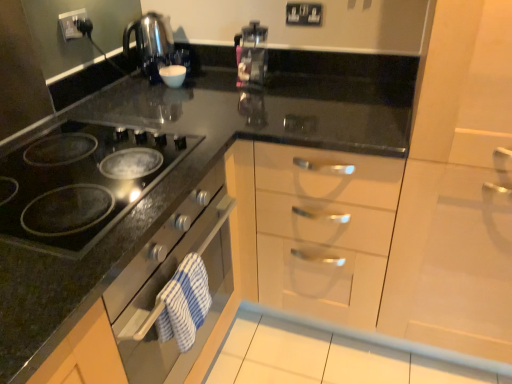
Question: Considering the relative positions of black plastic electric outlet at upper left, acting as the 2th electric outlet starting from the right, and black glass cooktop at left in the image provided, is black plastic electric outlet at upper left, acting as the 2th electric outlet starting from the right, to the right of black glass cooktop at left from the viewer's perspective?

Choices:
 (A) no
 (B) yes

Answer: (A)

Question: Is black plastic electric outlet at upper left, acting as the 2th electric outlet starting from the right, at the left side of black glass cooktop at left?

Choices:
 (A) yes
 (B) no

Answer: (A)

Question: Considering the relative positions of black plastic electric outlet at upper left, the first electric outlet positioned from the front, and black glass cooktop at left in the image provided, is black plastic electric outlet at upper left, the first electric outlet positioned from the front, behind black glass cooktop at left?

Choices:
 (A) no
 (B) yes

Answer: (B)

Question: Is black plastic electric outlet at upper left, the first electric outlet positioned from the front, taller than black glass cooktop at left?

Choices:
 (A) no
 (B) yes

Answer: (B)

Question: From the image's perspective, does black plastic electric outlet at upper left, acting as the 2th electric outlet starting from the right, appear higher than black glass cooktop at left?

Choices:
 (A) yes
 (B) no

Answer: (A)

Question: From a real-world perspective, relative to transparent plastic coffee machine at center, is black glass cooktop at left vertically above or below?

Choices:
 (A) above
 (B) below

Answer: (B)

Question: Visually, is black glass cooktop at left positioned to the left or to the right of transparent plastic coffee machine at center?

Choices:
 (A) right
 (B) left

Answer: (B)

Question: Considering the positions of point (76, 213) and point (266, 29), is point (76, 213) closer or farther from the camera than point (266, 29)?

Choices:
 (A) farther
 (B) closer

Answer: (B)

Question: Is black glass cooktop at left inside the boundaries of transparent plastic coffee machine at center, or outside?

Choices:
 (A) outside
 (B) inside

Answer: (A)

Question: From the image's perspective, relative to black plastic electric outlet at upper left, which is counted as the first electric outlet, starting from the left, is black glass cooktop at left above or below?

Choices:
 (A) above
 (B) below

Answer: (B)

Question: Based on their sizes in the image, would you say black glass cooktop at left is bigger or smaller than black plastic electric outlet at upper left, the first electric outlet positioned from the front?

Choices:
 (A) big
 (B) small

Answer: (A)

Question: Relative to black plastic electric outlet at upper left, placed as the second electric outlet when sorted from back to front, is black glass cooktop at left in front or behind?

Choices:
 (A) front
 (B) behind

Answer: (A)

Question: In terms of width, does black glass cooktop at left look wider or thinner when compared to black plastic electric outlet at upper left, the first electric outlet positioned from the front?

Choices:
 (A) thin
 (B) wide

Answer: (B)

Question: From a real-world perspective, is black glass cooktop at left above or below white glossy cabinet at right?

Choices:
 (A) above
 (B) below

Answer: (A)

Question: Considering the positions of black glass cooktop at left and white glossy cabinet at right in the image, is black glass cooktop at left bigger or smaller than white glossy cabinet at right?

Choices:
 (A) big
 (B) small

Answer: (B)